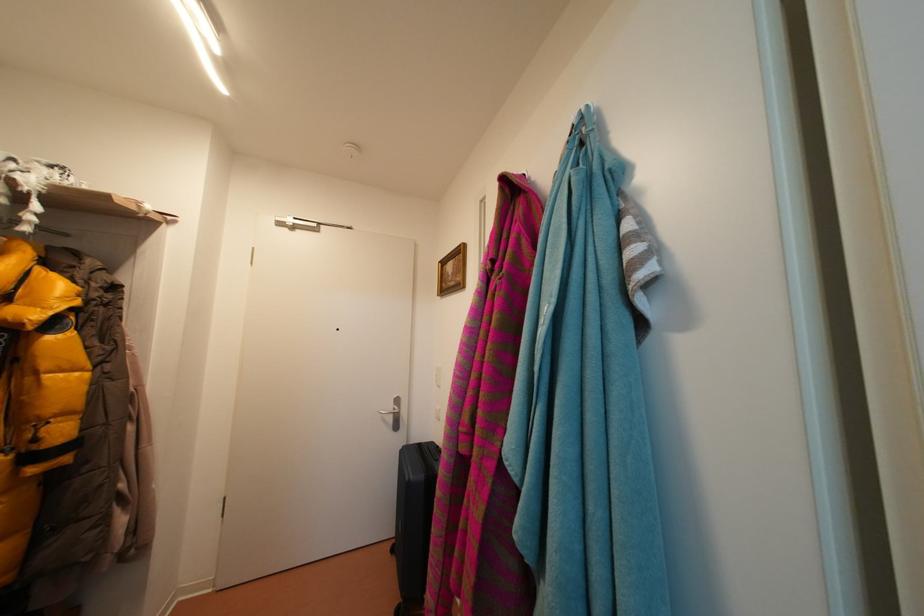
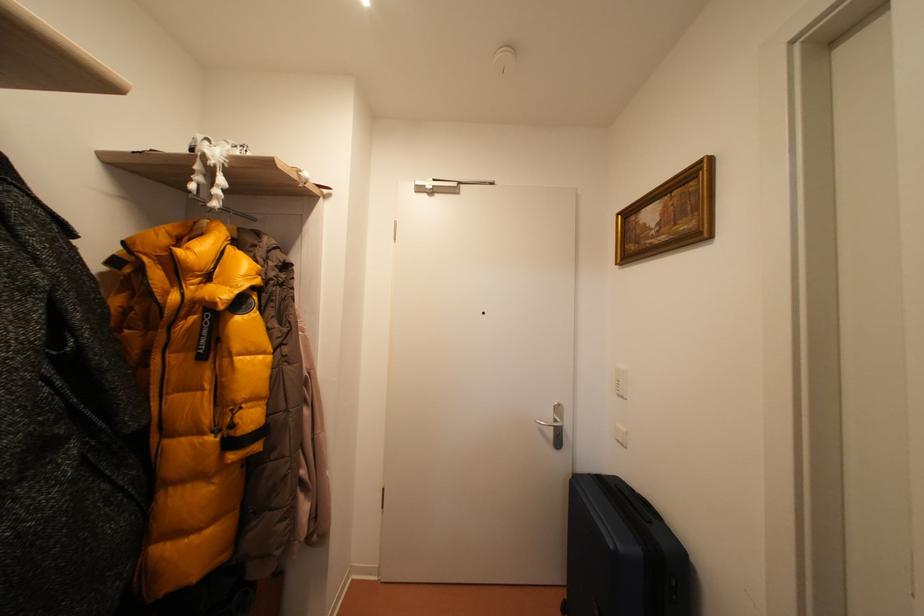
In a continuous first-person perspective shot, in which direction is the camera moving?

The cameraman moved toward left, forward.